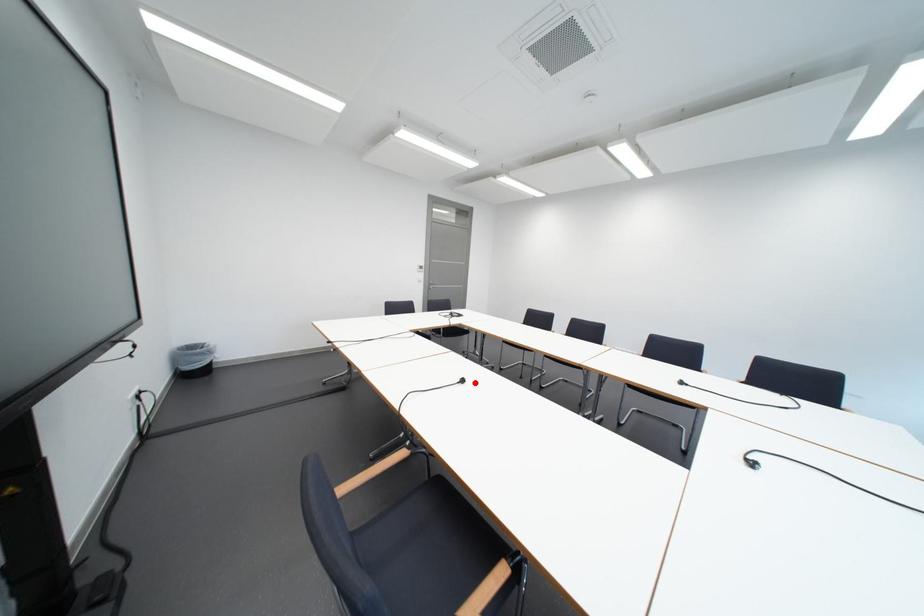
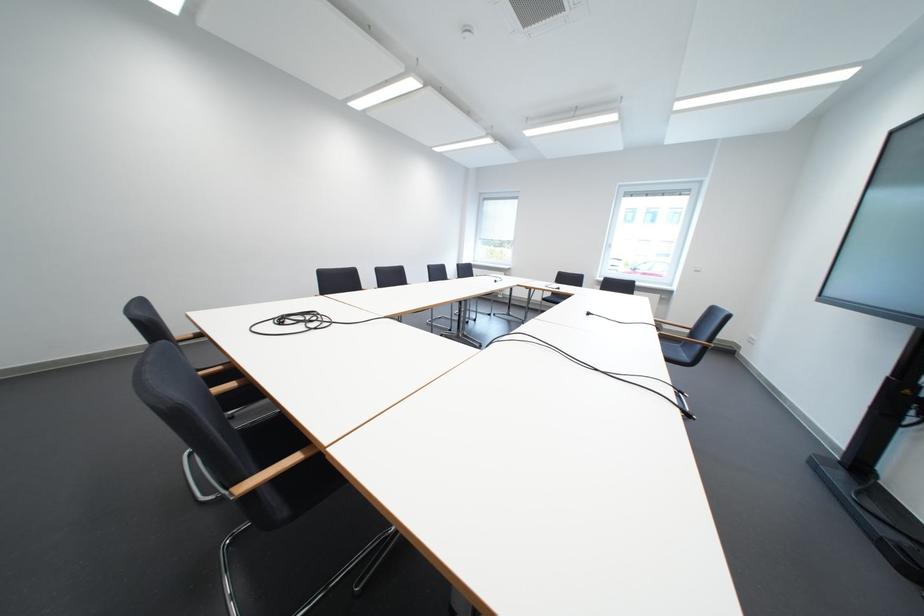
In the second image, find the point that corresponds to the highlighted location in the first image.

(601, 315)